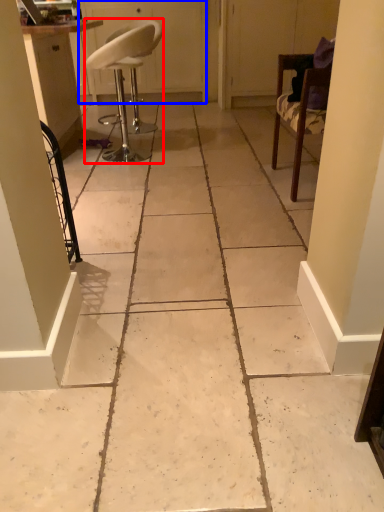
Question: Which of the following is the farthest to the observer, chair (highlighted by a red box) or screen door (highlighted by a blue box)?

Choices:
 (A) chair
 (B) screen door

Answer: (B)